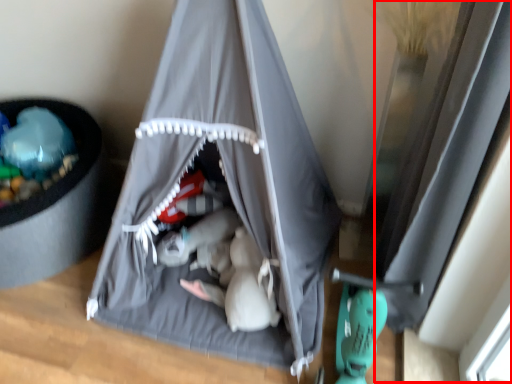
Question: From the image's perspective, where is window (annotated by the red box) located in relation to tent in the image?

Choices:
 (A) above
 (B) below

Answer: (B)